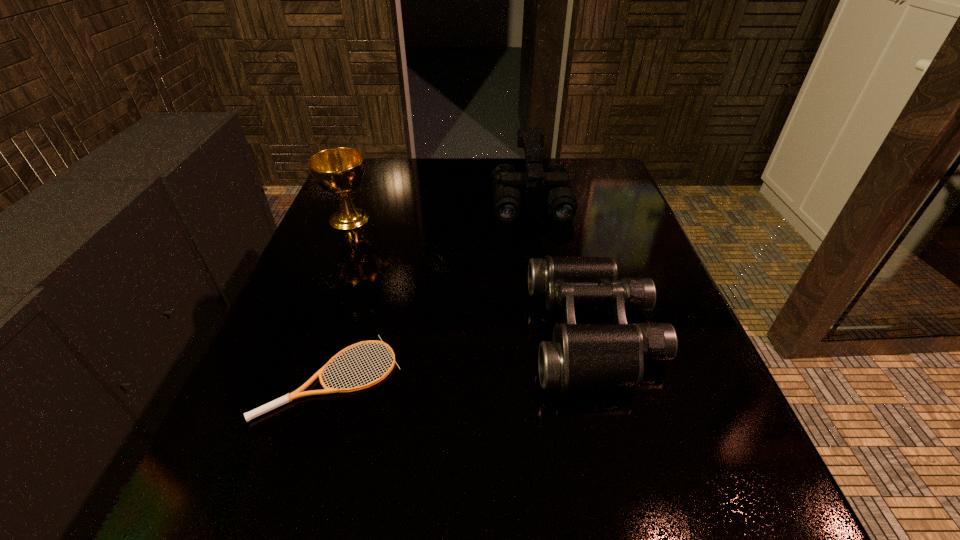
At what (x,y) coordinates should I click in order to perform the action: click on chalice. Please return your answer as a coordinate pair (x, y). Looking at the image, I should click on coord(339,170).

This screenshot has width=960, height=540. Find the location of `the taller binoculars`. the taller binoculars is located at coordinates (562, 205).

Where is `the nearer binoculars`? This screenshot has width=960, height=540. the nearer binoculars is located at coordinates (581, 356).

This screenshot has width=960, height=540. Find the location of `the shorter binoculars`. the shorter binoculars is located at coordinates (581, 356).

Where is `the shortest object`? This screenshot has height=540, width=960. the shortest object is located at coordinates (298, 393).

This screenshot has width=960, height=540. I want to click on free spot located 0.200m on the right of the chalice, so click(x=459, y=219).

Find the location of a particular element. This screenshot has width=960, height=540. vacant area situated 0.300m on the front lenses of the taller binoculars is located at coordinates (550, 318).

You are a GUI agent. You are given a task and a screenshot of the screen. Output one action in this format:
    pyautogui.click(x=<x>, y=<y>)
    Task: Click on the free location located on the front-facing side of the second shortest object
    
    Given the screenshot: What is the action you would take?
    pyautogui.click(x=340, y=332)

Identify the location of free spot located 0.250m on the front-facing side of the second shortest object. The height and width of the screenshot is (540, 960). (391, 332).

Identify the location of free space located on the front-facing side of the second shortest object. The image size is (960, 540). (476, 332).